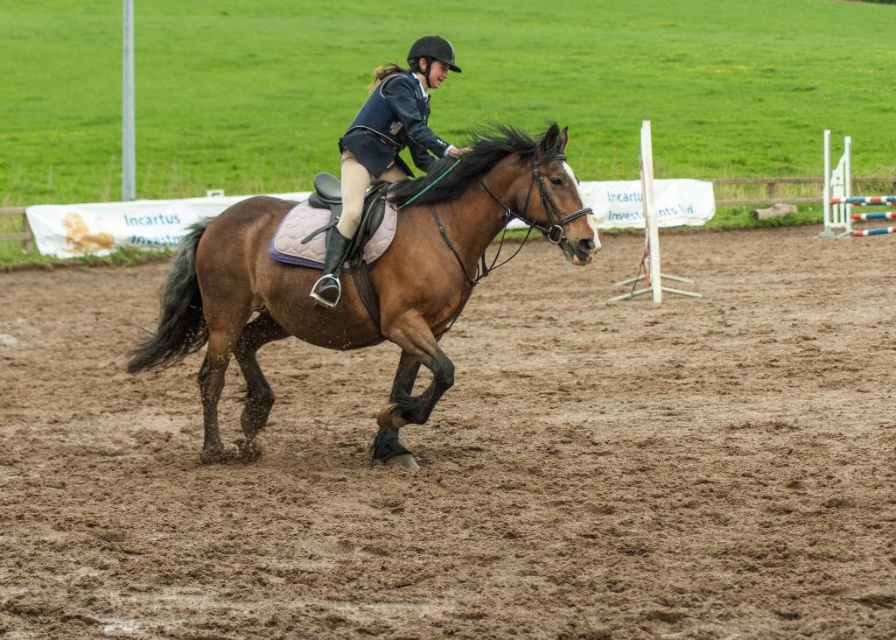
Can you confirm if brown sandy dirt at center is shorter than white plastic hurdle at upper right?

Yes, brown sandy dirt at center is shorter than white plastic hurdle at upper right.

Who is more forward, (x=143, y=308) or (x=841, y=170)?

Positioned in front is point (x=143, y=308).

At what (x,y) coordinates should I click in order to perform the action: click on brown sandy dirt at center. Please return your answer as a coordinate pair (x, y). The image size is (896, 640). Looking at the image, I should click on (474, 461).

Is brown glossy horse at center to the left of white wooden hurdle at center right from the viewer's perspective?

Correct, you'll find brown glossy horse at center to the left of white wooden hurdle at center right.

Which of these two, brown glossy horse at center or white wooden hurdle at center right, stands shorter?

brown glossy horse at center

Does point (418, 358) come closer to viewer compared to point (676, 289)?

Yes, point (418, 358) is closer to viewer.

Where is `brown glossy horse at center`? Image resolution: width=896 pixels, height=640 pixels. brown glossy horse at center is located at coordinates (358, 282).

Where is `white plastic hurdle at upper right`? This screenshot has width=896, height=640. white plastic hurdle at upper right is located at coordinates (850, 198).

Describe the element at coordinates (850, 198) in the screenshot. I see `white plastic hurdle at upper right` at that location.

Is point (862, 195) behind point (638, 291)?

Yes, it is.

I want to click on white plastic hurdle at upper right, so click(x=850, y=198).